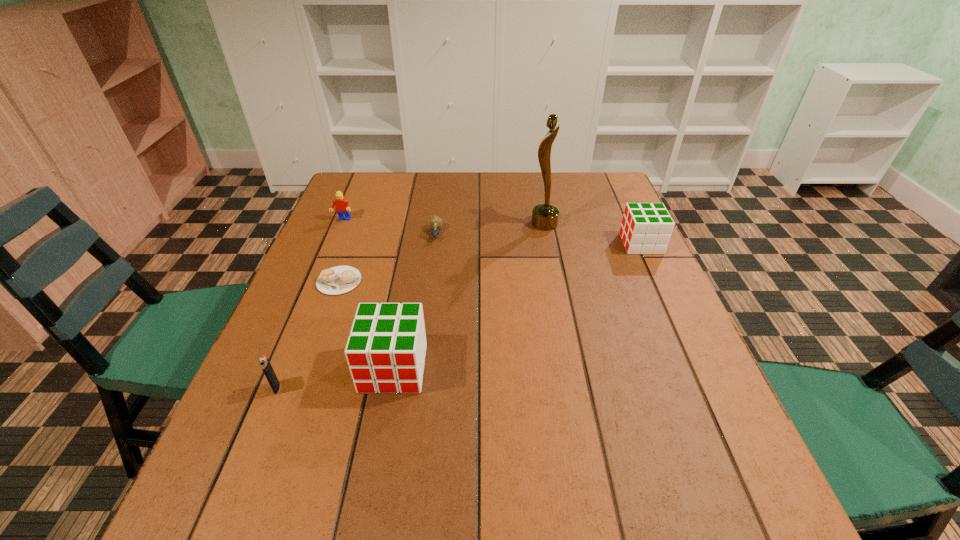
Find the location of a particular element. This screenshot has width=960, height=540. igniter is located at coordinates (264, 362).

Find the location of `free region located on the red face of the sixth shortest object`. free region located on the red face of the sixth shortest object is located at coordinates (385, 417).

Where is `free location located 0.200m on the red face of the shorter cube`? The width and height of the screenshot is (960, 540). free location located 0.200m on the red face of the shorter cube is located at coordinates (550, 244).

In order to click on free space located 0.080m on the red face of the shorter cube in this screenshot , I will do `click(594, 244)`.

Where is `vacant space situated 0.350m on the red face of the shorter cube`? The image size is (960, 540). vacant space situated 0.350m on the red face of the shorter cube is located at coordinates (495, 244).

The width and height of the screenshot is (960, 540). Find the location of `vacant space situated 0.260m on the front-facing side of the award`. vacant space situated 0.260m on the front-facing side of the award is located at coordinates (442, 224).

At what (x,y) coordinates should I click in order to perform the action: click on vacant space located on the front-facing side of the award. Please return your answer as a coordinate pair (x, y). Looking at the image, I should click on (421, 224).

I want to click on vacant region located on the front-facing side of the award, so click(x=397, y=224).

Find the location of a particular element. Image resolution: width=960 pixels, height=540 pixels. free spot located on the front-facing side of the Lego is located at coordinates (310, 299).

In order to click on free space located on the front-facing side of the second shortest object in this screenshot , I will do `click(433, 258)`.